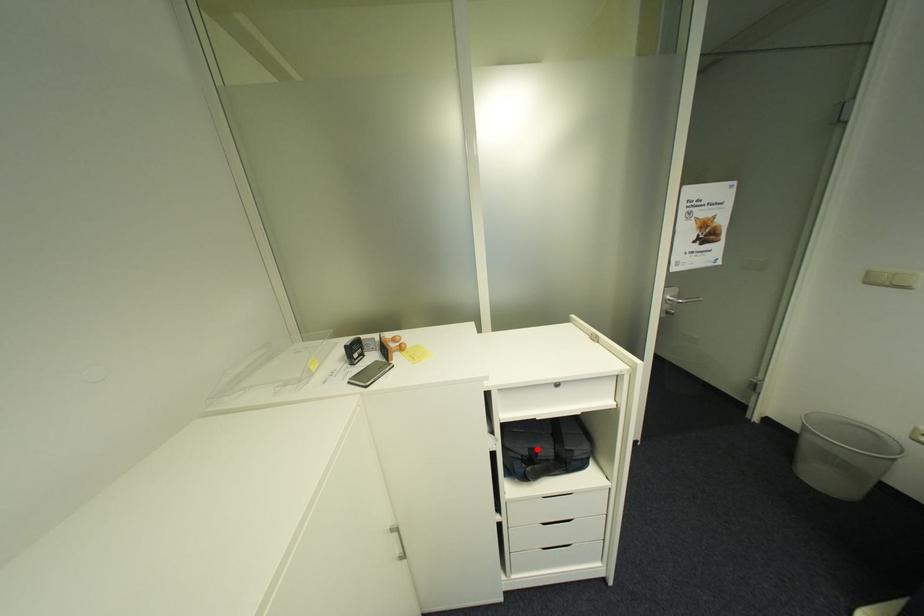
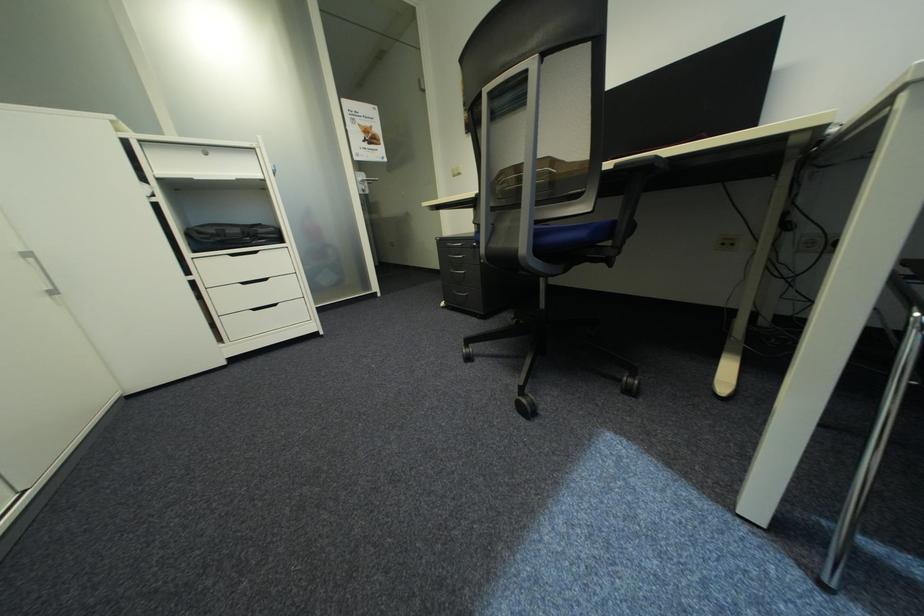
In the second image, find the point that corresponds to the highlighted location in the first image.

(225, 230)